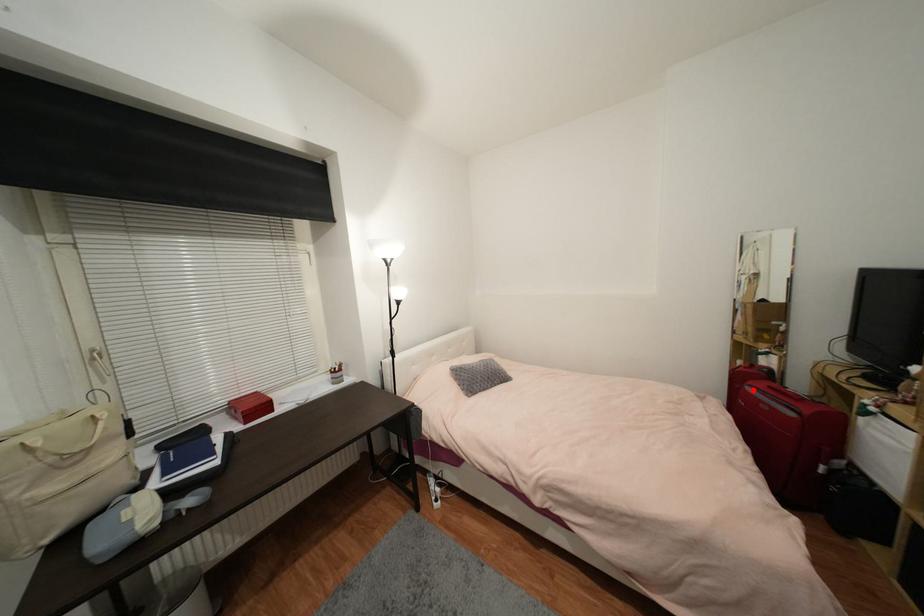
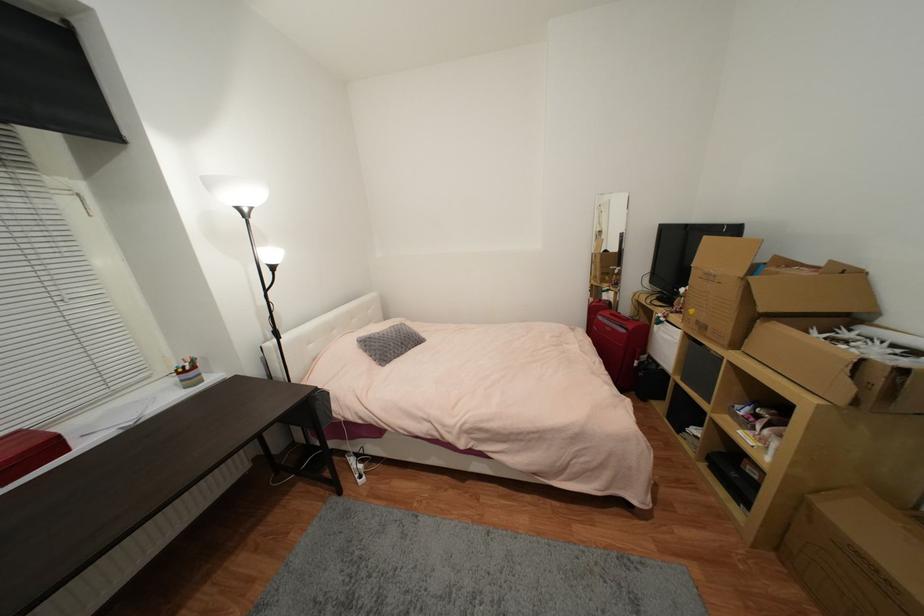
Find the pixel in the second image that matches the highlighted location in the first image.

(603, 318)